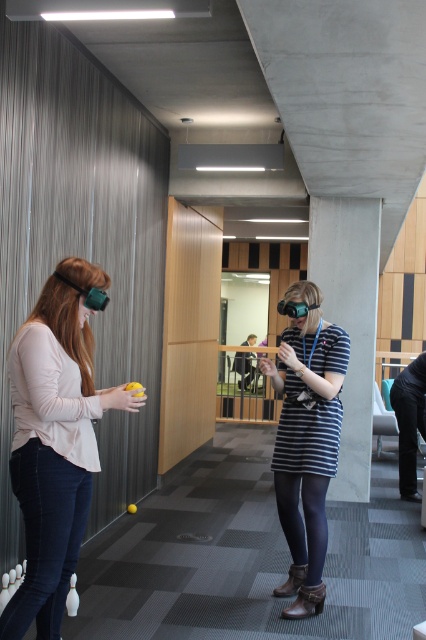
You are a delivery person who needs to place a package between the matte green vr headset at left and the matte green goggles at left. The package is 20 inches long. Will it fit between them?

The distance between the matte green vr headset at left and the matte green goggles at left is 19.55 inches. Since the package is 20 inches long, it will not fit between them as the package is slightly longer than the available space.

You are a delivery robot that is 1 meter wide. You need to move from the entrance to the right side of the room. There are two obstacles in your path, the matte green goggles at left and the matte black goggles at center. Can you navigate between them without hitting either?

The matte green goggles at left and matte black goggles at center are 1.31 meters apart from each other, so yes, the robot can navigate between them since the distance is wider than the robot.